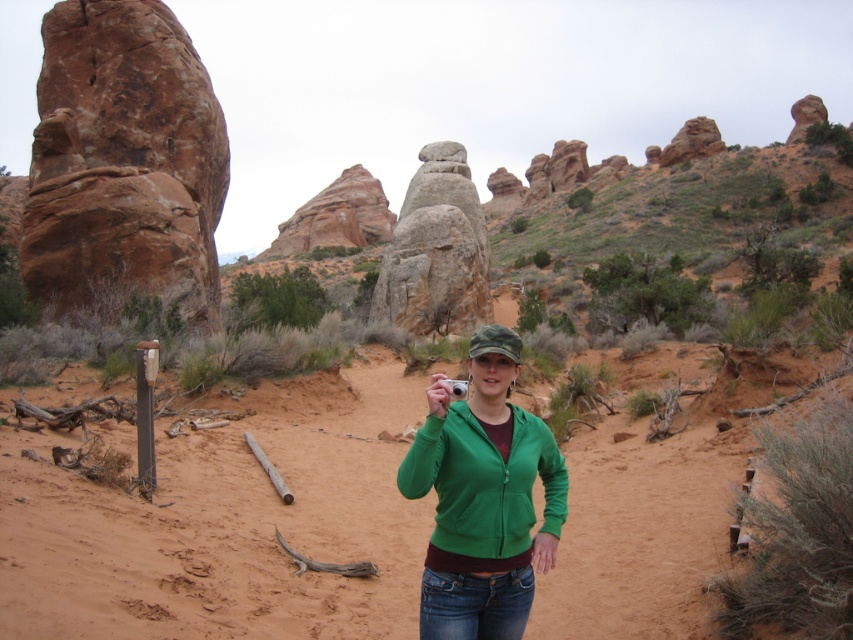
Question: Which of the following is the farthest from the observer?

Choices:
 (A) sandy brown at center
 (B) rustic sandstone rock at center
 (C) rustic sandstone rock formation at left
 (D) green fleece jacket at center

Answer: (B)

Question: Is sandy brown at center thinner than rustic sandstone rock at center?

Choices:
 (A) no
 (B) yes

Answer: (B)

Question: In this image, where is sandy brown at center located relative to green fleece jacket at center?

Choices:
 (A) right
 (B) left

Answer: (B)

Question: Can you confirm if sandy brown at center is bigger than green fleece jacket at center?

Choices:
 (A) no
 (B) yes

Answer: (B)

Question: Which object is closer to the camera taking this photo?

Choices:
 (A) green fleece jacket at center
 (B) sandy brown at center
 (C) rustic sandstone rock at center

Answer: (B)

Question: Which is nearer to the rustic stone formation at center?

Choices:
 (A) rustic sandstone rock formation at left
 (B) green fleece jacket at center
 (C) sandy brown at center

Answer: (A)